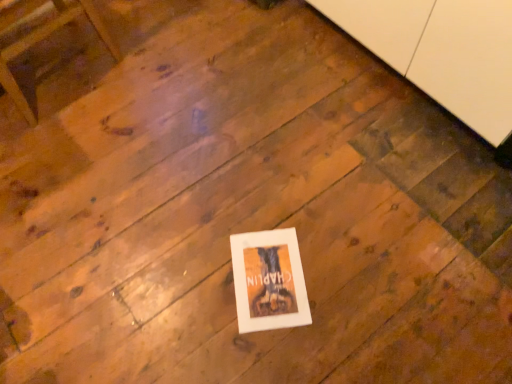
The width and height of the screenshot is (512, 384). I want to click on vacant space to the right of white paper at center, so click(x=337, y=271).